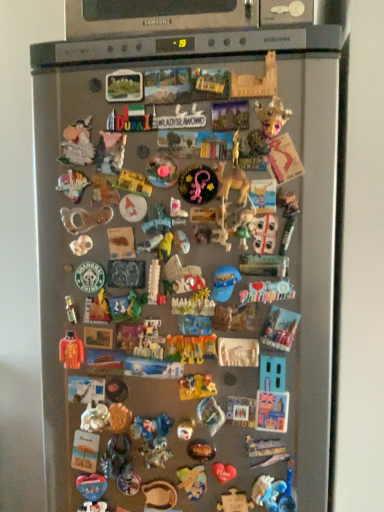
Question: From a real-world perspective, is plastic toy at center, the 26th toy positioned from the top, under shiny plastic toy at center, which ranks as the eighth toy in bottom-to-top order?

Choices:
 (A) no
 (B) yes

Answer: (B)

Question: From a real-world perspective, is plastic toy at center, the 26th toy positioned from the top, on top of shiny plastic toy at center, which ranks as the eighth toy in bottom-to-top order?

Choices:
 (A) yes
 (B) no

Answer: (B)

Question: Does plastic toy at center, the 26th toy positioned from the top, have a greater height compared to shiny plastic toy at center, which ranks as the eighth toy in bottom-to-top order?

Choices:
 (A) no
 (B) yes

Answer: (B)

Question: Does plastic toy at center, the 26th toy positioned from the top, have a smaller size compared to shiny plastic toy at center, which is counted as the 25th toy, starting from the top?

Choices:
 (A) yes
 (B) no

Answer: (B)

Question: Is shiny plastic toy at center, which is counted as the 25th toy, starting from the top, surrounded by plastic toy at center, the 26th toy positioned from the top?

Choices:
 (A) yes
 (B) no

Answer: (B)

Question: Considering the positions of white plastic toy at center, positioned as the 25th toy in bottom-to-top order, and white plastic magnet at center, which is counted as the 16th toy, starting from the bottom, in the image, is white plastic toy at center, positioned as the 25th toy in bottom-to-top order, taller or shorter than white plastic magnet at center, which is counted as the 16th toy, starting from the bottom,?

Choices:
 (A) short
 (B) tall

Answer: (B)

Question: In the image, is white plastic toy at center, positioned as the 25th toy in bottom-to-top order, positioned in front of or behind white plastic magnet at center, which is counted as the 16th toy, starting from the bottom?

Choices:
 (A) behind
 (B) front

Answer: (A)

Question: Is point (172, 198) positioned closer to the camera than point (271, 293)?

Choices:
 (A) closer
 (B) farther

Answer: (B)

Question: From the image's perspective, is white plastic toy at center, which ranks as the eighth toy in top-to-bottom order, located above or below white plastic magnet at center, which is counted as the 16th toy, starting from the bottom?

Choices:
 (A) above
 (B) below

Answer: (A)

Question: Is point (198, 362) positioned closer to the camera than point (215, 429)?

Choices:
 (A) farther
 (B) closer

Answer: (B)

Question: In the image, is translucent plastic toy at center, the 22th toy positioned from the top, on the left side or the right side of plastic toy at center, the 26th toy positioned from the top?

Choices:
 (A) left
 (B) right

Answer: (A)

Question: From the image's perspective, is translucent plastic toy at center, which is the eleventh toy in bottom-to-top order, located above or below plastic toy at center, marked as the seventh toy in a bottom-to-top arrangement?

Choices:
 (A) below
 (B) above

Answer: (B)

Question: Is translucent plastic toy at center, which is the eleventh toy in bottom-to-top order, wider or thinner than plastic toy at center, the 26th toy positioned from the top?

Choices:
 (A) thin
 (B) wide

Answer: (A)

Question: From the image's perspective, is wooden puzzle piece at center, acting as the 18th toy starting from the bottom, located above or below multicolored plastic toy at upper left, marked as the 27th toy in a bottom-to-top arrangement?

Choices:
 (A) above
 (B) below

Answer: (B)

Question: In the image, is wooden puzzle piece at center, acting as the 18th toy starting from the bottom, positioned in front of or behind multicolored plastic toy at upper left, marked as the 27th toy in a bottom-to-top arrangement?

Choices:
 (A) behind
 (B) front

Answer: (B)